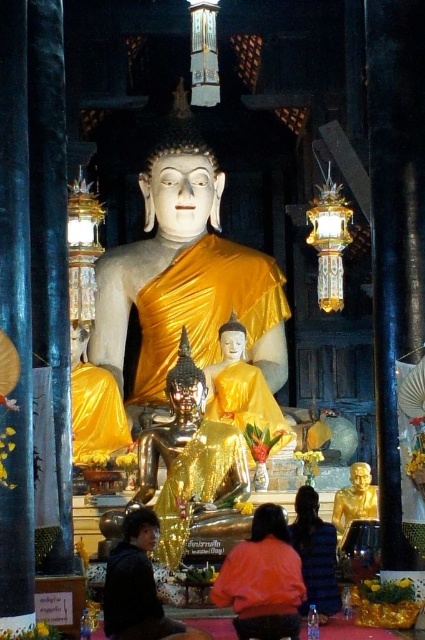
Question: Does matte gold statue at center appear on the left side of orange matte robe at center?

Choices:
 (A) yes
 (B) no

Answer: (A)

Question: Which point is closer to the camera?

Choices:
 (A) shiny gold statue at center
 (B) black matte robe at lower left
 (C) gold/yellow fabric buddha at center

Answer: (B)

Question: Which object appears farthest from the camera in this image?

Choices:
 (A) gold metallic statue at lower center
 (B) blue cotton shirt at center
 (C) matte gold statue at center

Answer: (C)

Question: Which point appears farthest from the camera in this image?

Choices:
 (A) (209, 380)
 (B) (210, 499)
 (C) (107, 381)

Answer: (A)

Question: Is shiny gold statue at center above gold metallic statue at lower center?

Choices:
 (A) yes
 (B) no

Answer: (A)

Question: Is matte gold statue at center bigger than gold/yellow fabric statue at center?

Choices:
 (A) no
 (B) yes

Answer: (B)